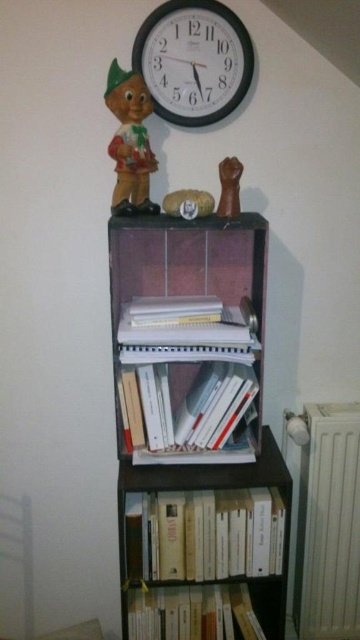
Question: Is white plastic clock at upper center to the right of white paper book at center from the viewer's perspective?

Choices:
 (A) yes
 (B) no

Answer: (A)

Question: Based on their relative distances, which object is nearer to the brown matte fist at upper center?

Choices:
 (A) matte plastic figurine at upper left
 (B) white paper book at center

Answer: (A)

Question: Is white metallic radiator at lower right smaller than brown matte fist at upper center?

Choices:
 (A) no
 (B) yes

Answer: (A)

Question: Which object is positioned farthest from the wooden bookshelf at center?

Choices:
 (A) hardcover book at lower center
 (B) white plastic clock at upper center

Answer: (B)

Question: Can you confirm if white metallic radiator at lower right is positioned below white paper book at center?

Choices:
 (A) yes
 (B) no

Answer: (A)

Question: Which of the following is the closest to the observer?

Choices:
 (A) (213, 426)
 (B) (230, 593)
 (C) (160, 77)
 (D) (132, 476)

Answer: (D)